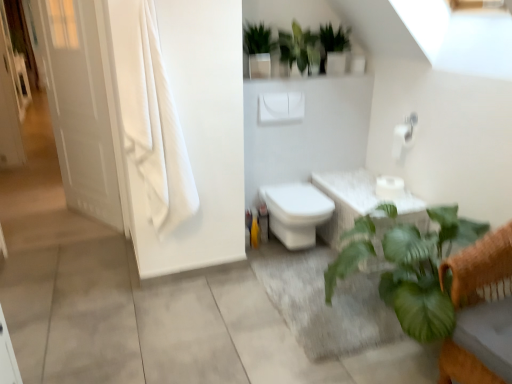
Question: Are white matte toilet paper at center, the first toilet paper ordered from the bottom, and white matte toilet paper at upper right, the 2th toilet paper ordered from the bottom, making contact?

Choices:
 (A) yes
 (B) no

Answer: (B)

Question: Does white matte toilet paper at center, the first toilet paper ordered from the bottom, have a larger size compared to white matte toilet paper at upper right, the 1th toilet paper from the top?

Choices:
 (A) no
 (B) yes

Answer: (B)

Question: Is white matte toilet paper at center, the second toilet paper viewed from the top, to the right of white matte toilet paper at upper right, the 2th toilet paper ordered from the bottom, from the viewer's perspective?

Choices:
 (A) yes
 (B) no

Answer: (B)

Question: Would you say white matte toilet paper at center, the second toilet paper viewed from the top, contains white matte toilet paper at upper right, the 1th toilet paper from the top?

Choices:
 (A) no
 (B) yes

Answer: (A)

Question: Can you confirm if white matte toilet paper at center, the second toilet paper viewed from the top, is shorter than white matte toilet paper at upper right, the 1th toilet paper from the top?

Choices:
 (A) yes
 (B) no

Answer: (A)

Question: Is white matte toilet paper at center, the second toilet paper viewed from the top, looking in the opposite direction of white matte toilet paper at upper right, the 1th toilet paper from the top?

Choices:
 (A) yes
 (B) no

Answer: (B)

Question: Can you confirm if green leafy plant at lower right is smaller than green leafy plant at lower right?

Choices:
 (A) yes
 (B) no

Answer: (A)

Question: From the image's perspective, is green leafy plant at lower right beneath green leafy plant at lower right?

Choices:
 (A) yes
 (B) no

Answer: (B)

Question: Is green leafy plant at lower right oriented away from green leafy plant at lower right?

Choices:
 (A) no
 (B) yes

Answer: (A)

Question: Would you say green leafy plant at lower right is part of green leafy plant at lower right's contents?

Choices:
 (A) yes
 (B) no

Answer: (B)

Question: Does green leafy plant at lower right have a larger size compared to green leafy plant at lower right?

Choices:
 (A) yes
 (B) no

Answer: (B)

Question: Is green leafy plant at lower right outside green leafy plant at lower right?

Choices:
 (A) yes
 (B) no

Answer: (A)

Question: Is the position of green matte plant at upper center, which is the 1th vegetation from right to left, less distant than that of green glossy plant at upper center, which is the 2th vegetation in right-to-left order?

Choices:
 (A) no
 (B) yes

Answer: (A)